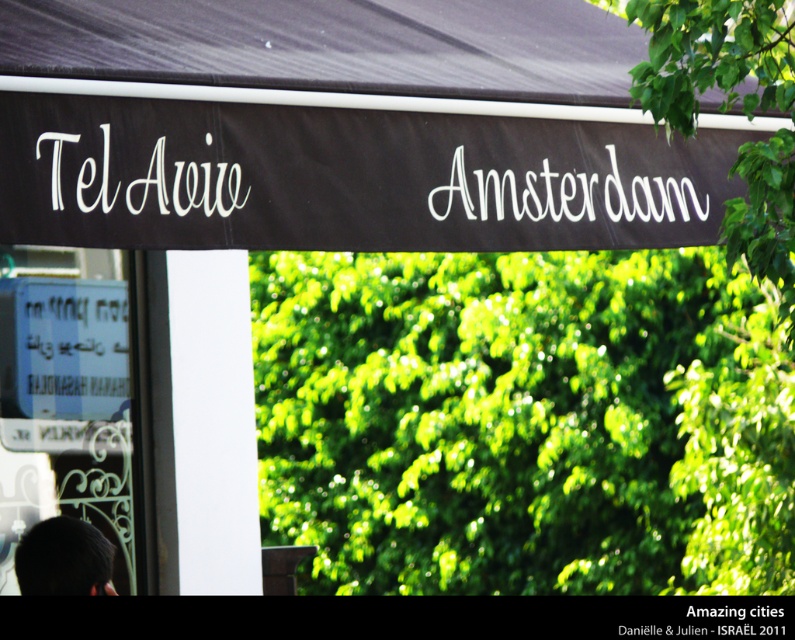
Is black fabric canopy at upper center to the left of white fabric tel aviv at upper left from the viewer's perspective?

Incorrect, black fabric canopy at upper center is not on the left side of white fabric tel aviv at upper left.

Who is taller, black fabric canopy at upper center or white fabric tel aviv at upper left?

Standing taller between the two is black fabric canopy at upper center.

I want to click on black fabric canopy at upper center, so 340,129.

Who is higher up, black fabric canopy at upper center or black hair at lower left?

Positioned higher is black fabric canopy at upper center.

Between point (231, 173) and point (107, 547), which one is positioned behind?

Point (107, 547)

I want to click on black fabric canopy at upper center, so click(x=340, y=129).

Which of these two, white painted text at upper center or black hair at lower left, stands taller?

black hair at lower left is taller.

Between point (520, 189) and point (61, 536), which one is positioned behind?

The point (61, 536) is more distant.

Which is in front, point (619, 205) or point (18, 577)?

Point (619, 205) is in front.

At what (x,y) coordinates should I click in order to perform the action: click on white painted text at upper center. Please return your answer as a coordinate pair (x, y). The width and height of the screenshot is (795, 640). Looking at the image, I should click on (565, 195).